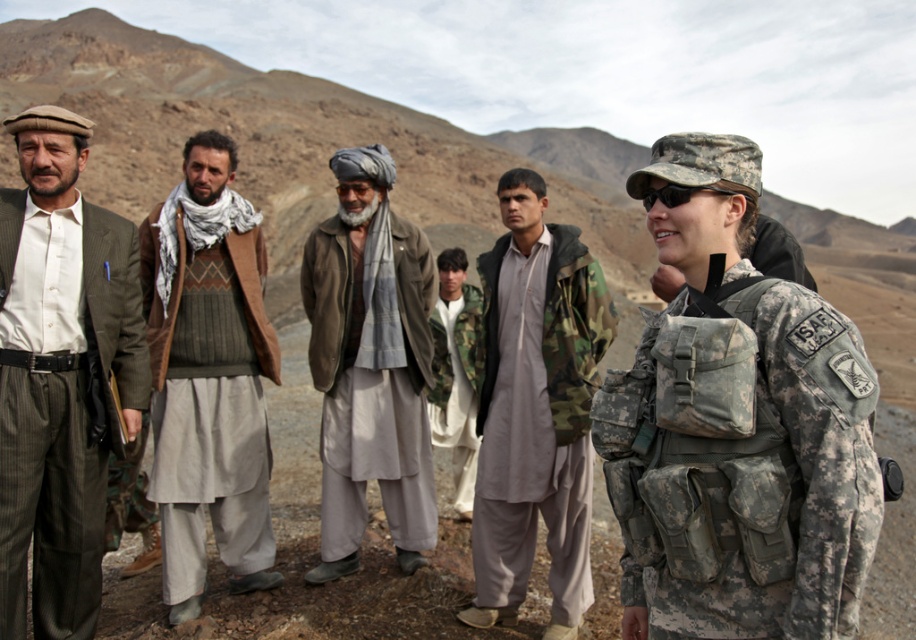
Looking at this image, you are a photographer taking a picture of the group in the mountainous terrain. You want to ensure the knitted wool sweater at center is in focus. Where should you aim your camera to capture it?

You should aim your camera at point (208, 387) to capture the knitted wool sweater at center in focus.

You are a hiker planning to take a photo of the knitted wool sweater at center and the camouflage fabric backpack at right. Since you want both items in the frame, which one should you focus on to ensure both are in focus?

You should focus on the knitted wool sweater at center because it is located above the camouflage fabric backpack at right, so focusing on the one closer to you will help both be in focus.

Looking at this image, you are a hiker preparing for a cold mountain hike. You have both the knitted wool sweater at center and the gray woolen jacket at center available. Based on the description, which clothing item would provide better insulation against the cold?

The gray woolen jacket at center is thicker than the knitted wool sweater at center, so it would provide better insulation against the cold.